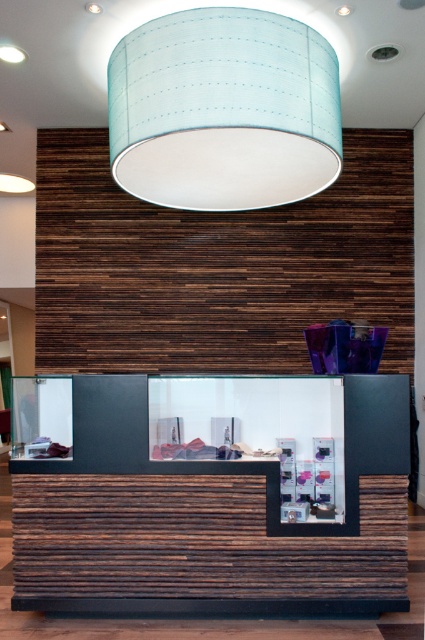
Does light blue fabric lampshade at upper center have a larger size compared to wooden reception desk at center?

Correct, light blue fabric lampshade at upper center is larger in size than wooden reception desk at center.

Describe the element at coordinates (223, 109) in the screenshot. The image size is (425, 640). I see `light blue fabric lampshade at upper center` at that location.

Which is behind, point (220, 154) or point (51, 609)?

The point (220, 154) is behind.

Locate an element on the screen. Image resolution: width=425 pixels, height=640 pixels. light blue fabric lampshade at upper center is located at coordinates (223, 109).